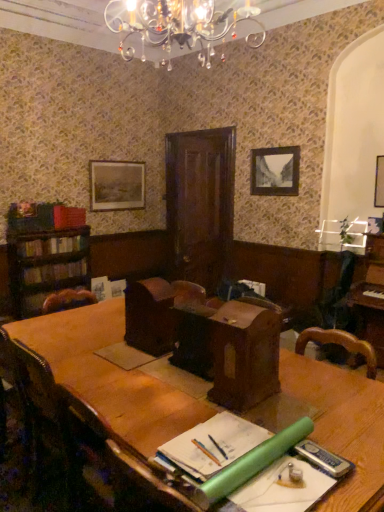
This screenshot has width=384, height=512. What are the coordinates of `vacant space that is to the left of brown leather armchair at center, which is the 2th armchair in left-to-right order` in the screenshot? It's located at (161, 370).